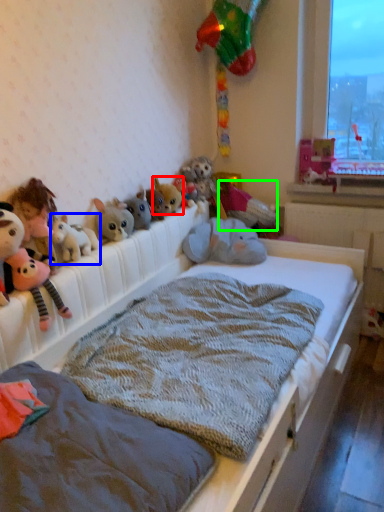
Question: Considering the real-world distances, which object is closest to toy (highlighted by a red box)? toy (highlighted by a blue box) or toy (highlighted by a green box).

Choices:
 (A) toy
 (B) toy

Answer: (B)